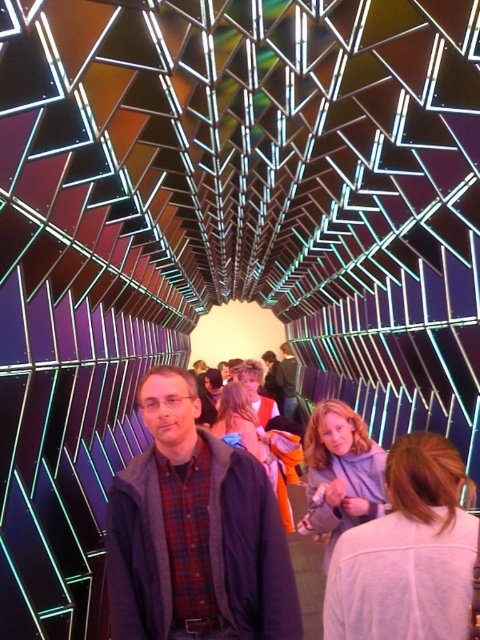
Question: Is plaid shirt at center behind matte black jacket at center?

Choices:
 (A) yes
 (B) no

Answer: (B)

Question: Which point is closer to the camera?

Choices:
 (A) (295, 371)
 (B) (235, 476)

Answer: (B)

Question: Considering the relative positions of plaid shirt at center and matte black jacket at center in the image provided, where is plaid shirt at center located with respect to matte black jacket at center?

Choices:
 (A) left
 (B) right

Answer: (A)

Question: Is plaid shirt at center smaller than matte black jacket at center?

Choices:
 (A) no
 (B) yes

Answer: (B)